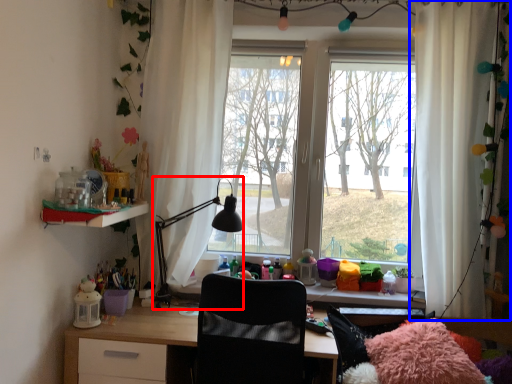
Question: Which point is closer to the camera, table lamp (highlighted by a red box) or curtain (highlighted by a blue box)?

Choices:
 (A) table lamp
 (B) curtain

Answer: (B)